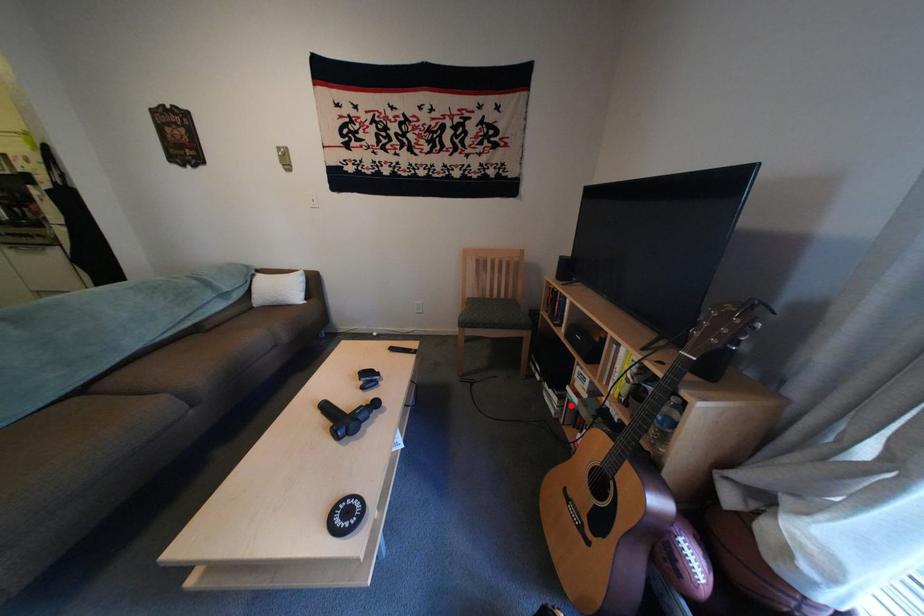
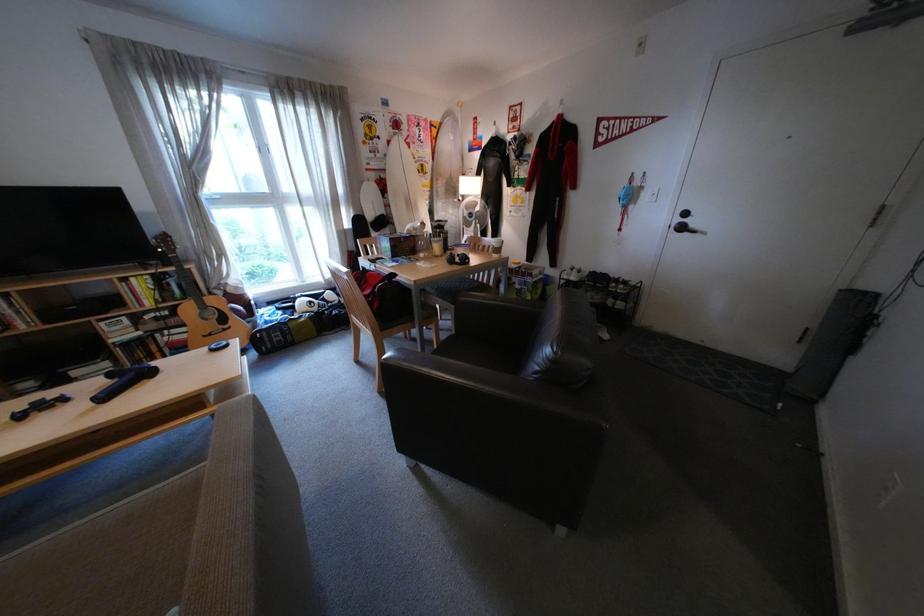
In the second image, find the point that corresponds to the highlighted location in the first image.

(126, 367)